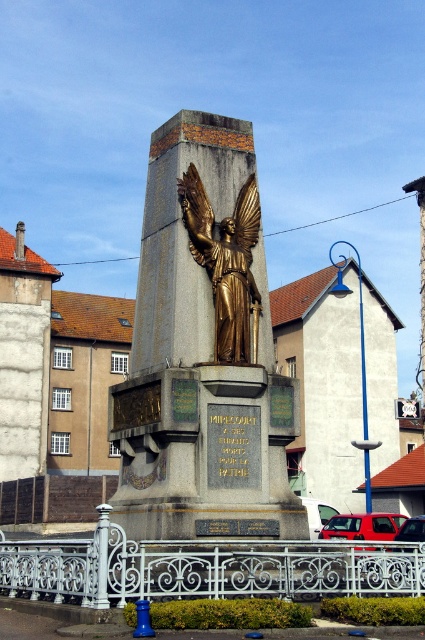
Does gold polished statue at center lie behind gold-bronze angel at center?

That is False.

Is point (144, 408) closer to viewer compared to point (235, 332)?

Yes.

Is point (249, 291) less distant than point (198, 212)?

No, (249, 291) is further to viewer.

The height and width of the screenshot is (640, 425). Identify the location of gold polished statue at center. (204, 352).